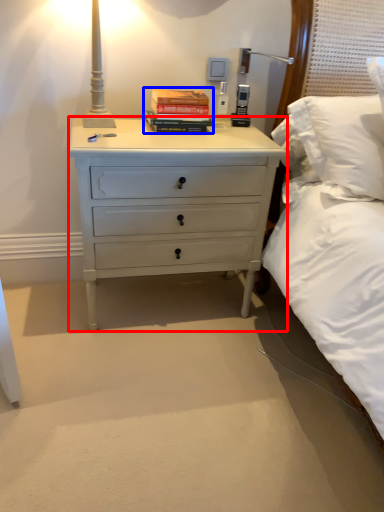
Question: Among these objects, which one is farthest to the camera, chest of drawers (highlighted by a red box) or paperback book (highlighted by a blue box)?

Choices:
 (A) chest of drawers
 (B) paperback book

Answer: (B)